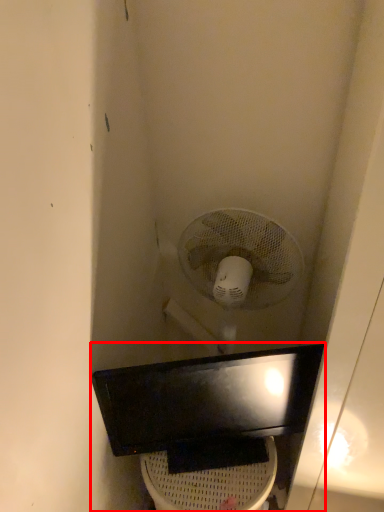
Question: Observing the image, what is the correct spatial positioning of sink (annotated by the red box) in reference to toilet bowl?

Choices:
 (A) right
 (B) left

Answer: (A)